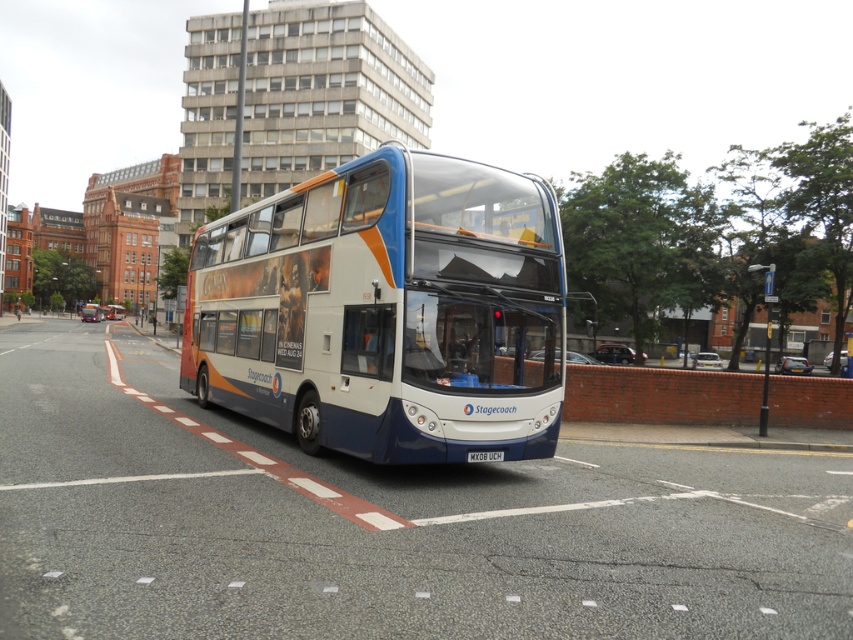
Question: Does white plastic license plate at center have a lesser width compared to white glossy bus at center?

Choices:
 (A) no
 (B) yes

Answer: (B)

Question: Which point is farther from the camera taking this photo?

Choices:
 (A) (120, 317)
 (B) (451, 346)
 (C) (491, 460)

Answer: (A)

Question: Among these points, which one is farthest from the camera?

Choices:
 (A) (486, 460)
 (B) (263, 234)

Answer: (B)

Question: Can you confirm if white glossy decker bus at center is positioned to the right of white glossy bus at center?

Choices:
 (A) yes
 (B) no

Answer: (A)

Question: Is white glossy decker bus at center smaller than white glossy bus at center?

Choices:
 (A) yes
 (B) no

Answer: (B)

Question: Which object appears farthest from the camera in this image?

Choices:
 (A) white glossy bus at center
 (B) white plastic license plate at center

Answer: (A)